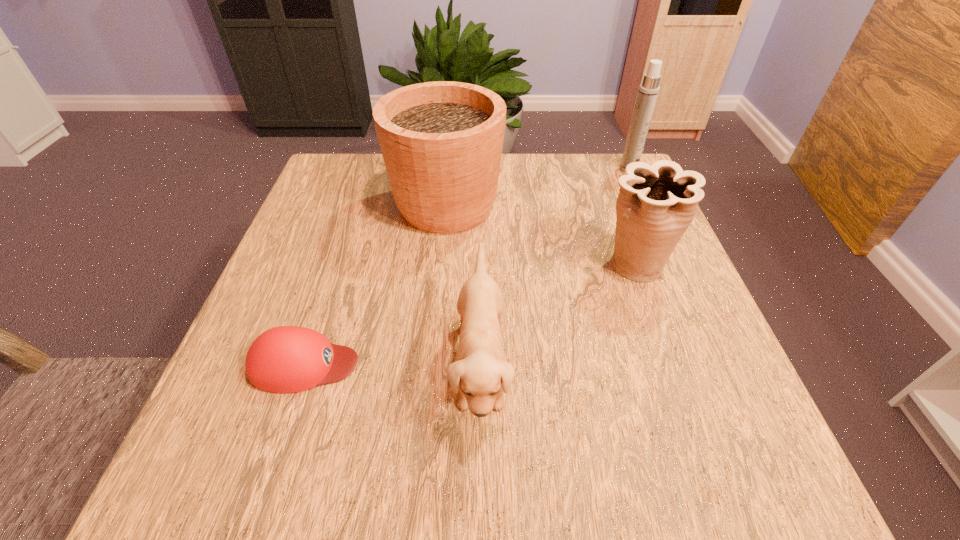
The height and width of the screenshot is (540, 960). In the image, there is a desktop. Find the location of `vacant area at the far edge`. vacant area at the far edge is located at coordinates (502, 183).

You are a GUI agent. You are given a task and a screenshot of the screen. Output one action in this format:
    pyautogui.click(x=<x>, y=<y>)
    Task: Click on the free space at the near edge of the desktop
    This screenshot has height=540, width=960.
    Given the screenshot: What is the action you would take?
    pyautogui.click(x=655, y=480)

Where is `vacant area at the left edge of the desktop`? vacant area at the left edge of the desktop is located at coordinates (351, 278).

You are a GUI agent. You are given a task and a screenshot of the screen. Output one action in this format:
    pyautogui.click(x=<x>, y=<y>)
    Task: Click on the free space at the right edge of the desktop
    The image size is (960, 540).
    Given the screenshot: What is the action you would take?
    coord(664,288)

Where is `free space at the far left corner`? free space at the far left corner is located at coordinates (309, 203).

Where is `free space at the far right corner`? The height and width of the screenshot is (540, 960). free space at the far right corner is located at coordinates (579, 169).

At what (x,y) coordinates should I click in order to perform the action: click on free point between the second shortest object and the urn. Please return your answer as a coordinate pair (x, y). Looking at the image, I should click on (558, 316).

Identify the location of free spot between the fourth nearest object and the baseball cap. Image resolution: width=960 pixels, height=540 pixels. (375, 285).

At what (x,y) coordinates should I click in order to perform the action: click on unoccupied position between the second farthest object and the aerosol can. Please return your answer as a coordinate pair (x, y). The image size is (960, 540). Looking at the image, I should click on (538, 187).

Where is `free space between the farthest object and the fourth tallest object`? The image size is (960, 540). free space between the farthest object and the fourth tallest object is located at coordinates (555, 267).